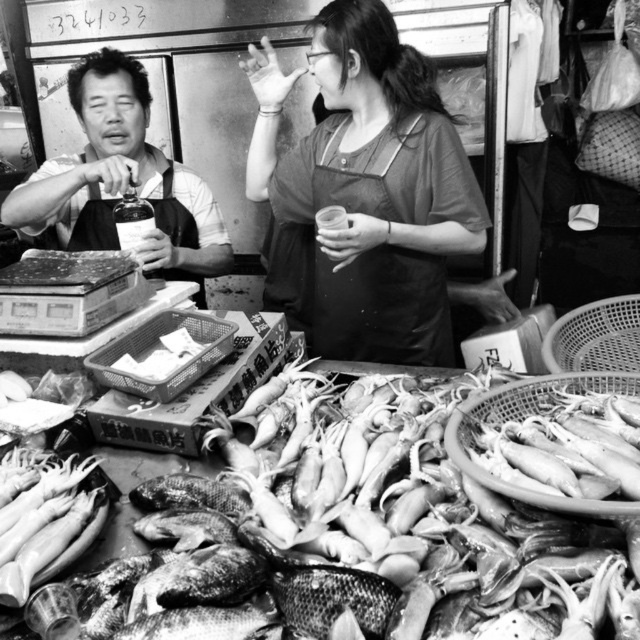
Who is positioned more to the right, smooth apron at left or black fabric apron at center?

Positioned to the right is black fabric apron at center.

Is point (172, 212) more distant than point (372, 360)?

Yes, point (172, 212) is farther from viewer.

The height and width of the screenshot is (640, 640). I want to click on smooth apron at left, so click(x=122, y=180).

Is matte apron at center smaller than black fabric apron at center?

Actually, matte apron at center might be larger than black fabric apron at center.

Is matte apron at center above black fabric apron at center?

Yes, matte apron at center is above black fabric apron at center.

Is point (378, 349) positioned after point (340, 348)?

No, (378, 349) is in front of (340, 348).

Where is `matte apron at center`? matte apron at center is located at coordinates (371, 186).

Who is taller, matte apron at center or smooth apron at left?

With more height is matte apron at center.

Is point (330, 40) positioned after point (96, 112)?

No, (330, 40) is closer to viewer.

Who is more distant from viewer, (417, 92) or (35, 177)?

The point (35, 177) is behind.

Identify the location of matte apron at center. The height and width of the screenshot is (640, 640). (371, 186).